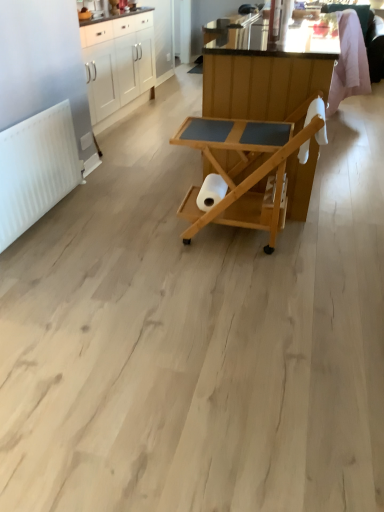
Question: Which direction should I rotate to look at natural wood serving cart at center, the second table positioned from the front, — up or down?

Choices:
 (A) up
 (B) down

Answer: (A)

Question: Considering the relative sizes of natural wood serving cart at center, placed as the second table when sorted from back to front, and white glossy cabinets at upper left in the image provided, is natural wood serving cart at center, placed as the second table when sorted from back to front, bigger than white glossy cabinets at upper left?

Choices:
 (A) yes
 (B) no

Answer: (B)

Question: Does natural wood serving cart at center, the first table viewed from the front, lie behind white glossy cabinets at upper left?

Choices:
 (A) yes
 (B) no

Answer: (B)

Question: Does natural wood serving cart at center, placed as the second table when sorted from back to front, contain white glossy cabinets at upper left?

Choices:
 (A) no
 (B) yes

Answer: (A)

Question: From the image's perspective, is natural wood serving cart at center, the first table viewed from the front, below white glossy cabinets at upper left?

Choices:
 (A) yes
 (B) no

Answer: (A)

Question: From the image's perspective, is natural wood serving cart at center, the first table viewed from the front, on top of white glossy cabinets at upper left?

Choices:
 (A) yes
 (B) no

Answer: (B)

Question: Can you confirm if natural wood serving cart at center, the first table viewed from the front, is positioned to the right of white glossy cabinets at upper left?

Choices:
 (A) no
 (B) yes

Answer: (B)

Question: From the image's perspective, does white matte radiator at left appear lower than natural wood serving cart at center, marked as the first table in a back-to-front arrangement?

Choices:
 (A) yes
 (B) no

Answer: (A)

Question: Is white matte radiator at left touching natural wood serving cart at center, the second table positioned from the front?

Choices:
 (A) no
 (B) yes

Answer: (A)

Question: Does white matte radiator at left lie in front of natural wood serving cart at center, the second table positioned from the front?

Choices:
 (A) yes
 (B) no

Answer: (A)

Question: Is white matte radiator at left bigger than natural wood serving cart at center, marked as the first table in a back-to-front arrangement?

Choices:
 (A) no
 (B) yes

Answer: (A)

Question: From a real-world perspective, is white matte radiator at left on top of natural wood serving cart at center, the second table positioned from the front?

Choices:
 (A) yes
 (B) no

Answer: (B)

Question: Does white matte radiator at left have a greater width compared to natural wood serving cart at center, the second table positioned from the front?

Choices:
 (A) no
 (B) yes

Answer: (A)

Question: Does white matte toilet paper at center appear on the right side of natural wood serving cart at center, the first table viewed from the front?

Choices:
 (A) no
 (B) yes

Answer: (A)